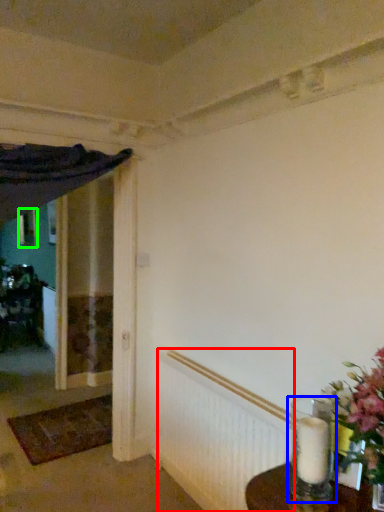
Question: Which object is positioned farthest from radiator (highlighted by a red box)? Select from candle holder (highlighted by a blue box) and picture frame (highlighted by a green box).

Choices:
 (A) candle holder
 (B) picture frame

Answer: (B)